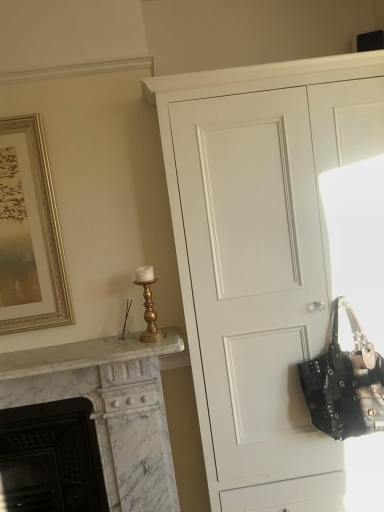
Question: Visually, is white marble fireplace at left, the 1th fireplace positioned from the left, positioned to the left or to the right of studded leather handbag at right?

Choices:
 (A) left
 (B) right

Answer: (A)

Question: From a real-world perspective, is white marble fireplace at left, the 2th fireplace when ordered from right to left, above or below studded leather handbag at right?

Choices:
 (A) above
 (B) below

Answer: (B)

Question: Estimate the real-world distances between objects in this image. Which object is farther from the studded leather handbag at right?

Choices:
 (A) gold framed picture at upper left
 (B) white marble fireplace at left, placed as the second fireplace when sorted from left to right
 (C) white matte cupboard at center
 (D) gold metallic candlestick at upper left
 (E) white marble fireplace at left, the 2th fireplace when ordered from right to left

Answer: (A)

Question: Which is nearer to the white marble fireplace at left, the 2th fireplace when ordered from right to left?

Choices:
 (A) studded leather handbag at right
 (B) white matte cupboard at center
 (C) gold metallic candlestick at upper left
 (D) white marble fireplace at left, which is counted as the first fireplace, starting from the right
 (E) gold framed picture at upper left

Answer: (D)